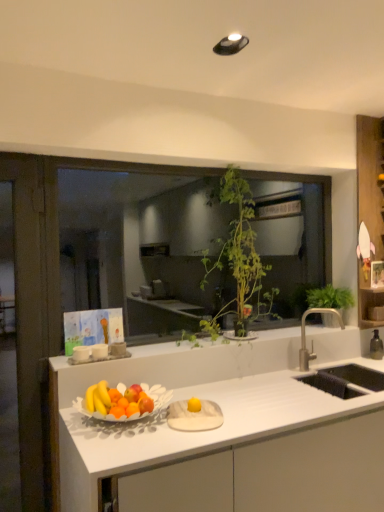
Identify the location of vacant area that lies to the right of silver metallic faucet at right. (346, 371).